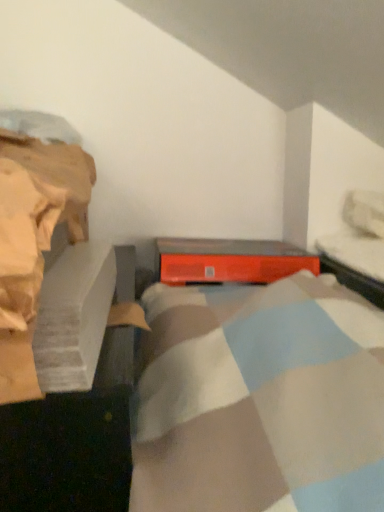
The height and width of the screenshot is (512, 384). What do you see at coordinates (230, 261) in the screenshot?
I see `orange matte speaker at center` at bounding box center [230, 261].

Where is `orange matte speaker at center`? orange matte speaker at center is located at coordinates (230, 261).

In order to face orange matte speaker at center, should I rotate leftwards or rightwards?

Turn right by 6.405 degrees to look at orange matte speaker at center.

The height and width of the screenshot is (512, 384). Describe the element at coordinates (358, 247) in the screenshot. I see `metallic gray bed frame at upper right` at that location.

Where is `metallic gray bed frame at upper right`? metallic gray bed frame at upper right is located at coordinates (358, 247).

At what (x,y) coordinates should I click in order to perform the action: click on orange matte speaker at center. Please return your answer as a coordinate pair (x, y). This screenshot has height=512, width=384. Looking at the image, I should click on (230, 261).

Which object is positioned more to the right, metallic gray bed frame at upper right or orange matte speaker at center?

metallic gray bed frame at upper right.

From the picture: Considering their positions, is metallic gray bed frame at upper right located in front of or behind orange matte speaker at center?

Visually, metallic gray bed frame at upper right is located in front of orange matte speaker at center.

Between point (376, 207) and point (234, 260), which one is positioned behind?

The point (376, 207) is farther.

From the image's perspective, is metallic gray bed frame at upper right on top of orange matte speaker at center?

Indeed, from the image's perspective, metallic gray bed frame at upper right is shown above orange matte speaker at center.

From a real-world perspective, is metallic gray bed frame at upper right under orange matte speaker at center?

No, from a real-world perspective, metallic gray bed frame at upper right is not beneath orange matte speaker at center.

Does metallic gray bed frame at upper right have a lesser width compared to orange matte speaker at center?

In fact, metallic gray bed frame at upper right might be wider than orange matte speaker at center.

Considering the sizes of objects metallic gray bed frame at upper right and orange matte speaker at center in the image provided, who is taller, metallic gray bed frame at upper right or orange matte speaker at center?

orange matte speaker at center is taller.

Considering the sizes of objects metallic gray bed frame at upper right and orange matte speaker at center in the image provided, who is bigger, metallic gray bed frame at upper right or orange matte speaker at center?

metallic gray bed frame at upper right is bigger.

Is metallic gray bed frame at upper right completely or partially outside of orange matte speaker at center?

Yes.

Does metallic gray bed frame at upper right touch orange matte speaker at center?

metallic gray bed frame at upper right is not next to orange matte speaker at center, and they're not touching.

Could you tell me if metallic gray bed frame at upper right is facing orange matte speaker at center?

Yes, metallic gray bed frame at upper right is aimed at orange matte speaker at center.

At what (x,y) coordinates should I click in order to perform the action: click on bed frame in front of the orange matte speaker at center. Please return your answer as a coordinate pair (x, y). This screenshot has height=512, width=384. Looking at the image, I should click on (358, 247).

Considering the relative positions of orange matte speaker at center and metallic gray bed frame at upper right in the image provided, is orange matte speaker at center to the left or to the right of metallic gray bed frame at upper right?

Clearly, orange matte speaker at center is on the left of metallic gray bed frame at upper right in the image.

Is the depth of orange matte speaker at center less than that of metallic gray bed frame at upper right?

No, it is behind metallic gray bed frame at upper right.

Which point is more distant from viewer, [308,264] or [368,275]?

Point [308,264]

From the image's perspective, is orange matte speaker at center positioned above or below metallic gray bed frame at upper right?

From the image's perspective, orange matte speaker at center appears below metallic gray bed frame at upper right.

From a real-world perspective, is orange matte speaker at center physically located above or below metallic gray bed frame at upper right?

From a real-world perspective, orange matte speaker at center is physically below metallic gray bed frame at upper right.

Between orange matte speaker at center and metallic gray bed frame at upper right, which one has smaller width?

Thinner between the two is orange matte speaker at center.

Who is shorter, orange matte speaker at center or metallic gray bed frame at upper right?

metallic gray bed frame at upper right is shorter.

Who is smaller, orange matte speaker at center or metallic gray bed frame at upper right?

orange matte speaker at center is smaller.

Is orange matte speaker at center situated inside metallic gray bed frame at upper right or outside?

orange matte speaker at center exists outside the volume of metallic gray bed frame at upper right.

Is orange matte speaker at center in contact with metallic gray bed frame at upper right?

No, orange matte speaker at center is not with metallic gray bed frame at upper right.

Is metallic gray bed frame at upper right at the back of orange matte speaker at center?

orange matte speaker at center does not have its back to metallic gray bed frame at upper right.

Measure the distance between orange matte speaker at center and metallic gray bed frame at upper right.

orange matte speaker at center is 22.84 centimeters away from metallic gray bed frame at upper right.

The image size is (384, 512). I want to click on equipment below the metallic gray bed frame at upper right (from the image's perspective), so click(x=230, y=261).

Image resolution: width=384 pixels, height=512 pixels. Identify the location of equipment on the left of metallic gray bed frame at upper right. (230, 261).

The image size is (384, 512). Identify the location of equipment behind the metallic gray bed frame at upper right. (230, 261).